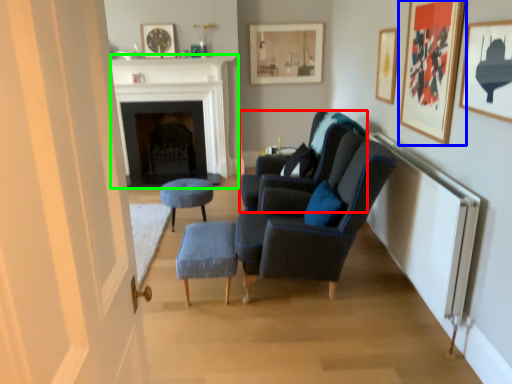
Question: Estimate the real-world distances between objects in this image. Which object is closer to chair (highlighted by a red box), picture frame (highlighted by a blue box) or fireplace (highlighted by a green box)?

Choices:
 (A) picture frame
 (B) fireplace

Answer: (A)